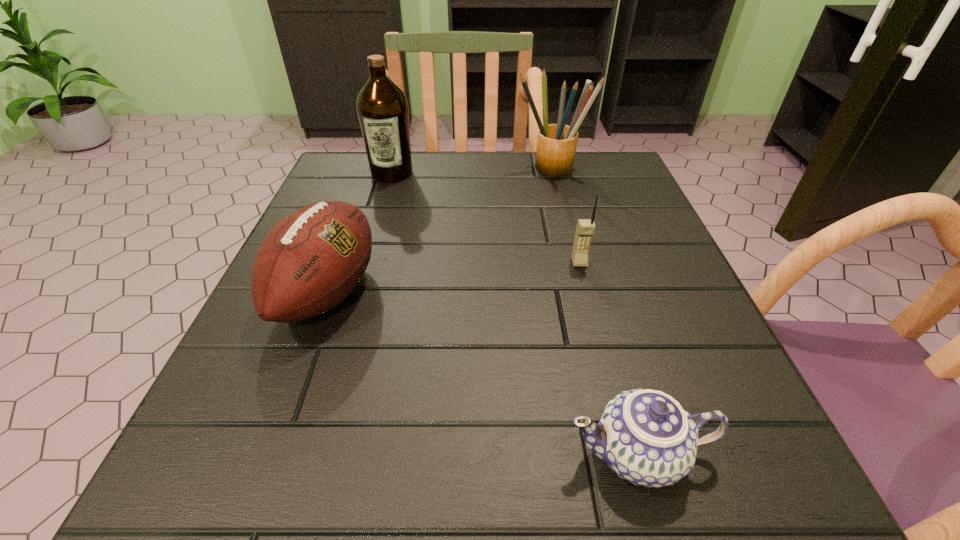
You are a GUI agent. You are given a task and a screenshot of the screen. Output one action in this format:
    pyautogui.click(x=<x>, y=<y>)
    Task: Click on the vacant space located 0.230m from the spout of the shortest object
    
    Given the screenshot: What is the action you would take?
    pyautogui.click(x=372, y=454)

What are the coordinates of `vacant position located from the spout of the shortest object` in the screenshot? It's located at (263, 454).

This screenshot has width=960, height=540. I want to click on free location located 0.160m from the spout of the shortest object, so [x=430, y=454].

The width and height of the screenshot is (960, 540). I want to click on olive oil present at the far edge, so click(x=382, y=108).

This screenshot has height=540, width=960. Find the location of `pencil box present at the far edge`. pencil box present at the far edge is located at coordinates (556, 143).

Locate an element on the screen. object located in the near edge section of the desktop is located at coordinates (644, 436).

Identify the location of olive oil present at the left edge. (382, 108).

This screenshot has width=960, height=540. I want to click on football (American) present at the left edge, so [x=311, y=260].

The image size is (960, 540). I want to click on pencil box located at the right edge, so click(556, 143).

At what (x,y) coordinates should I click in order to perform the action: click on chinaware that is at the right edge. Please return your answer as a coordinate pair (x, y). Image resolution: width=960 pixels, height=540 pixels. Looking at the image, I should click on (644, 436).